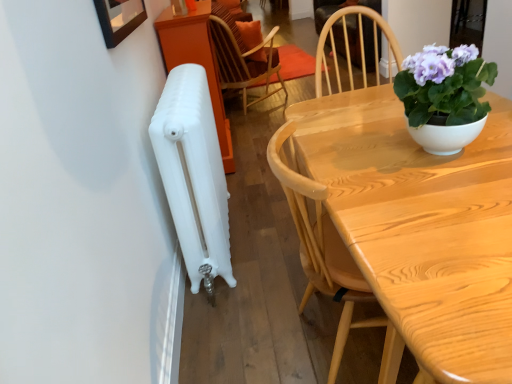
Question: Could you tell me if wooden chair at upper center is turned towards purple glossy plant at upper right?

Choices:
 (A) no
 (B) yes

Answer: (A)

Question: Can you confirm if wooden chair at upper center is smaller than purple glossy plant at upper right?

Choices:
 (A) no
 (B) yes

Answer: (A)

Question: Does wooden chair at upper center have a larger size compared to purple glossy plant at upper right?

Choices:
 (A) yes
 (B) no

Answer: (A)

Question: Is wooden chair at upper center completely or partially outside of purple glossy plant at upper right?

Choices:
 (A) no
 (B) yes

Answer: (B)

Question: From the image's perspective, is wooden chair at upper center located beneath purple glossy plant at upper right?

Choices:
 (A) no
 (B) yes

Answer: (A)

Question: Considering the positions of light wood table at center and purple glossy plant at upper right in the image, is light wood table at center taller or shorter than purple glossy plant at upper right?

Choices:
 (A) short
 (B) tall

Answer: (B)

Question: Is light wood table at center bigger or smaller than purple glossy plant at upper right?

Choices:
 (A) small
 (B) big

Answer: (B)

Question: Is point (417, 271) closer or farther from the camera than point (414, 62)?

Choices:
 (A) closer
 (B) farther

Answer: (A)

Question: Based on their positions, is light wood table at center located to the left or right of purple glossy plant at upper right?

Choices:
 (A) left
 (B) right

Answer: (A)

Question: In the image, is purple glossy plant at upper right on the left side or the right side of white matte radiator at left?

Choices:
 (A) right
 (B) left

Answer: (A)

Question: Is point (415, 139) positioned closer to the camera than point (190, 107)?

Choices:
 (A) farther
 (B) closer

Answer: (B)

Question: In terms of height, does purple glossy plant at upper right look taller or shorter compared to white matte radiator at left?

Choices:
 (A) short
 (B) tall

Answer: (A)

Question: From the image's perspective, is purple glossy plant at upper right positioned above or below white matte radiator at left?

Choices:
 (A) below
 (B) above

Answer: (B)

Question: Is white matte radiator at left inside the boundaries of light wood table at center, or outside?

Choices:
 (A) inside
 (B) outside

Answer: (B)

Question: From a real-world perspective, relative to light wood table at center, is white matte radiator at left vertically above or below?

Choices:
 (A) above
 (B) below

Answer: (A)